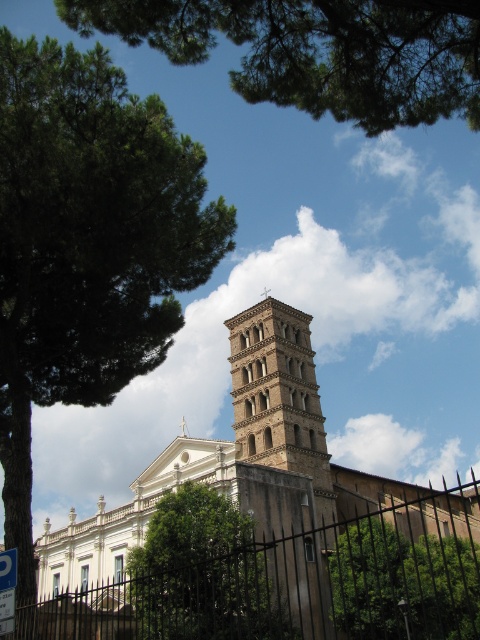
Question: Which point is farther to the camera?

Choices:
 (A) green leafy tree at left
 (B) green leafy tree at center
 (C) green leafy tree at upper left

Answer: (B)

Question: Which object appears closest to the camera in this image?

Choices:
 (A) black metal fence at lower center
 (B) green leafy tree at upper left

Answer: (B)

Question: Is green leafy tree at upper left above green leafy tree at center?

Choices:
 (A) no
 (B) yes

Answer: (B)

Question: Which object is closer to the camera taking this photo?

Choices:
 (A) green leafy tree at center
 (B) black metal fence at lower center
 (C) green leafy tree at lower center
 (D) green leafy tree at upper left

Answer: (D)

Question: Is green leafy tree at left smaller than green leafy tree at upper left?

Choices:
 (A) yes
 (B) no

Answer: (B)

Question: Does black metal fence at lower center have a greater width compared to green leafy tree at upper left?

Choices:
 (A) yes
 (B) no

Answer: (A)